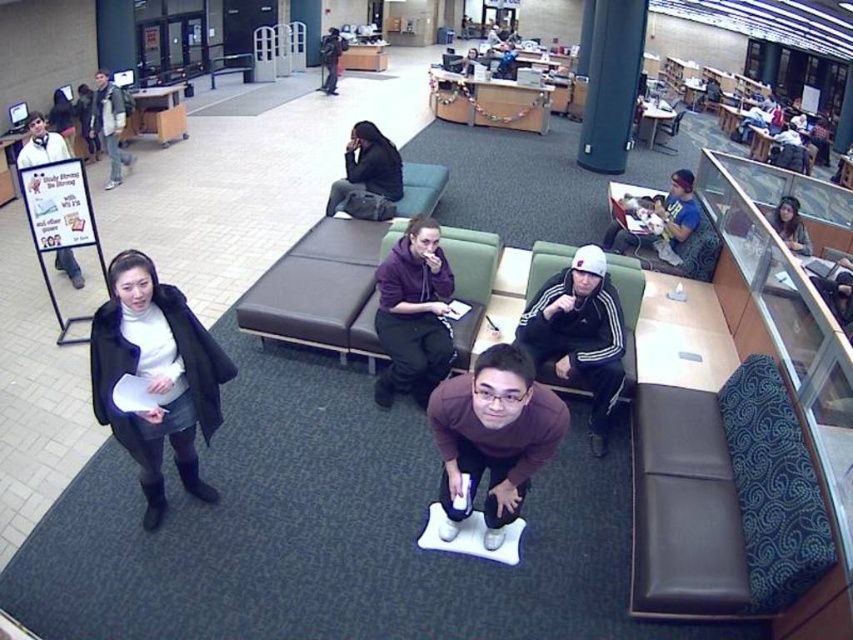
You are a person who wants to pick up the brown matte sweater at center without moving the light brown leather jacket at upper left. Is this possible?

The brown matte sweater at center is positioned under the light brown leather jacket at upper left, so you cannot pick up the brown matte sweater at center without moving the light brown leather jacket at upper left.

Consider the image. You are a tailor who needs to determine which of the two items, the brown matte sweater at center or the light brown leather jacket at upper left, requires more fabric for alterations. Based on their sizes, which one would need more fabric?

The light brown leather jacket at upper left requires more fabric for alterations because it has a greater width than the brown matte sweater at center.

You are a person entering the library and want to find the brown matte sweater at center. Which direction should you look relative to the black matte coat at left?

The brown matte sweater at center is behind the black matte coat at left, so you should look behind the black matte coat at left to find it.